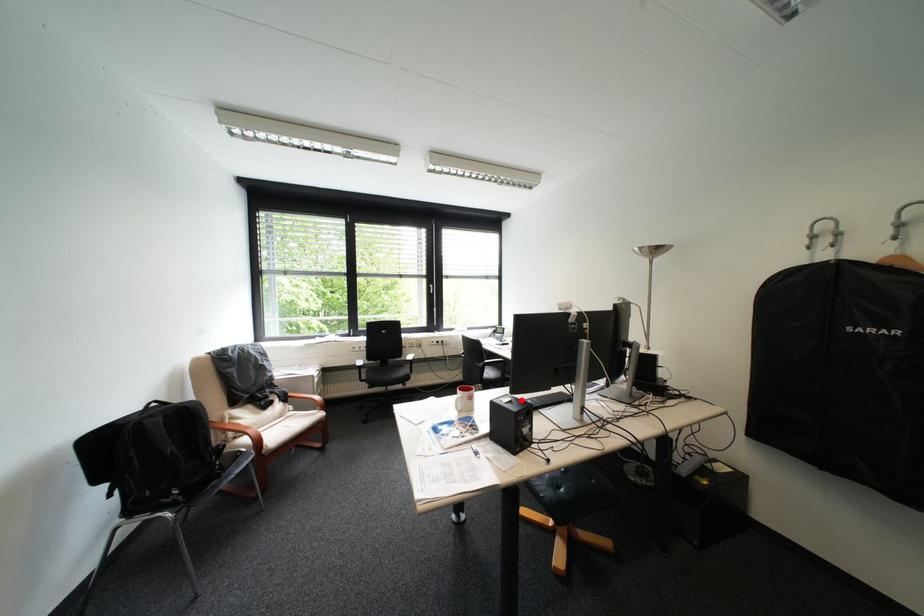
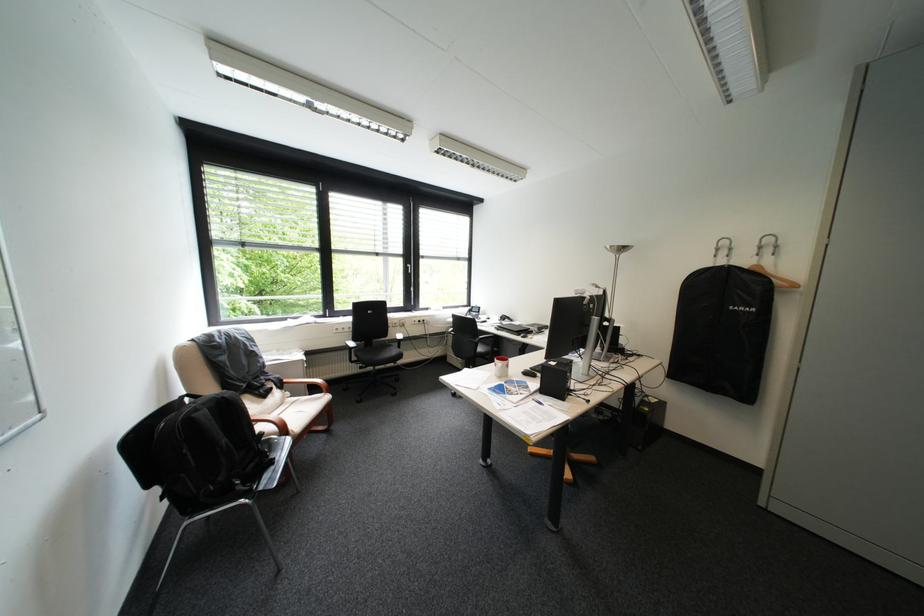
Question: I am providing you with two images of the same scene from different viewpoints. Image1 has a red point marked. In image2, the corresponding 3D location appears at what relative position? Reply with the corresponding letter.

Choices:
 (A) Closer
 (B) Farther

Answer: (B)